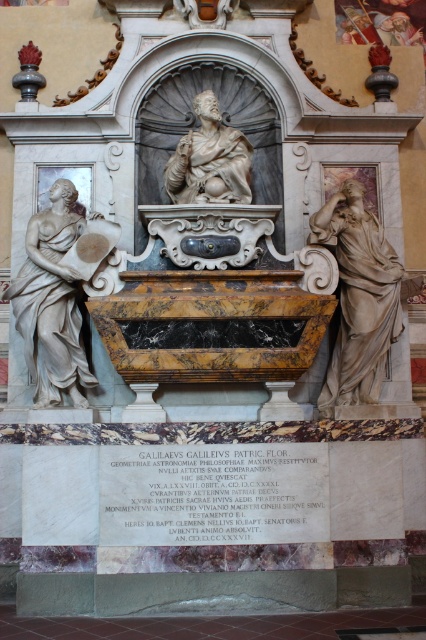
Question: Which object appears farthest from the camera in this image?

Choices:
 (A) matte white statue at right
 (B) marble statue at center
 (C) white marble statue at left

Answer: (B)

Question: Considering the relative positions of white marble statue at left and marble statue at center in the image provided, where is white marble statue at left located with respect to marble statue at center?

Choices:
 (A) below
 (B) above

Answer: (A)

Question: Where is matte white statue at right located in relation to marble statue at center in the image?

Choices:
 (A) left
 (B) right

Answer: (B)

Question: Can you confirm if matte white statue at right is positioned above marble statue at center?

Choices:
 (A) yes
 (B) no

Answer: (B)

Question: Which point appears closest to the camera in this image?

Choices:
 (A) (201, 122)
 (B) (17, 285)

Answer: (B)

Question: Which is farther from the matte white statue at right?

Choices:
 (A) marble statue at center
 (B) white marble statue at left

Answer: (B)